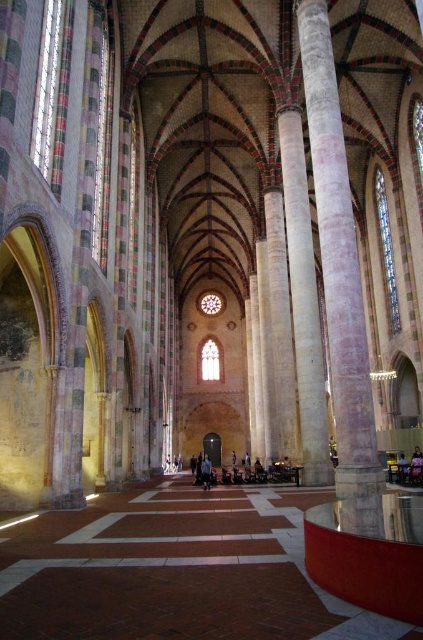
You are standing inside the cathedral and want to touch the white marble pillars. Which pillar, the white marble pillar at right or the white marble pillar at center, can you reach first if you walk straight ahead?

The white marble pillar at right is closer to the viewer than the white marble pillar at center, so you can reach the white marble pillar at right first when walking straight ahead.

You are standing at the entrance of the cathedral and want to move towards the white marble pillar at right. Given that the cathedral has a floor plan with a central nave and side aisles, can you reach the pillar directly from your current position without entering the side aisles?

The white marble pillar at right is located at point coordinates that suggest it is positioned along the right side of the cathedral. Since the central nave is typically separated from the side aisles by pillars, you would need to enter the right side aisle to reach the white marble pillar at right. Therefore, you cannot reach it directly from the entrance without entering the side aisles.

You are an interior designer planning to place a decorative item between the white marble pillar at center and the blue denim jeans at center. Which object should the item be placed closer to if you want it to be equidistant from both objects based on their widths?

The decorative item should be placed closer to the blue denim jeans at center since the white marble pillar at center is wider. This ensures the equidistant placement accounts for their differing widths.